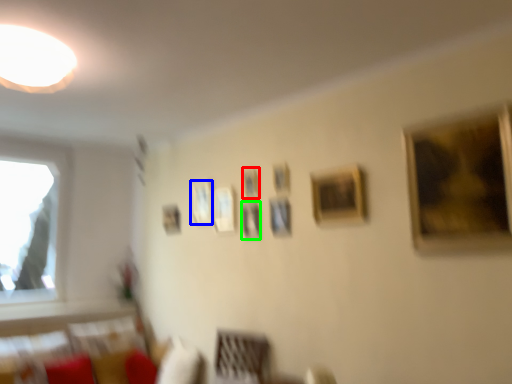
Question: Estimate the real-world distances between objects in this image. Which object is closer to picture frame (highlighted by a red box), picture frame (highlighted by a blue box) or picture frame (highlighted by a green box)?

Choices:
 (A) picture frame
 (B) picture frame

Answer: (B)